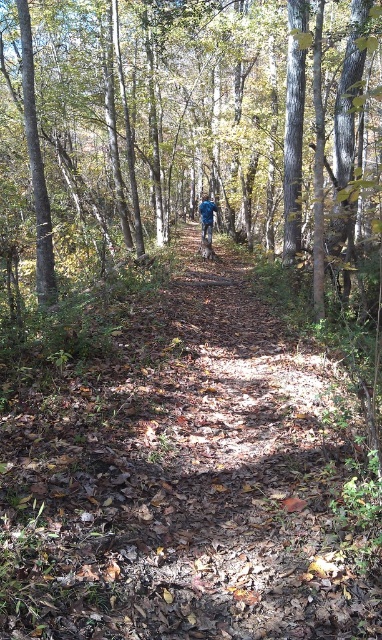
You are standing at the entrance of the forest and see the brown wood tree at center. If you were to walk directly towards the tree, which direction should you head?

Since the brown wood tree at center is located at point 0.173 on the x axis and 0.437 on the y axis, you should walk towards the center of the image to reach it.